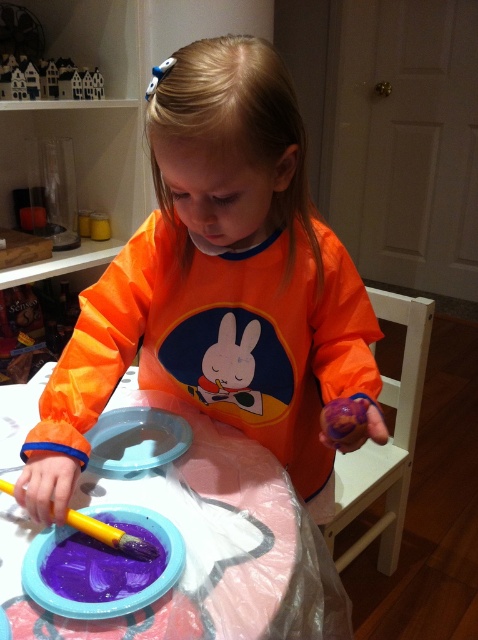
Question: Which object is positioned closest to the purple plastic plate at lower center?

Choices:
 (A) yellow plastic paint brush at lower left
 (B) purple rubber toy at lower center
 (C) wooden toy houses at upper left
 (D) orange matte shirt at center

Answer: (A)

Question: Among these objects, which one is farthest from the camera?

Choices:
 (A) orange matte shirt at center
 (B) plastic covered table at center

Answer: (A)

Question: Is orange matte shirt at center closer to the viewer compared to transparent plastic plate at center?

Choices:
 (A) no
 (B) yes

Answer: (B)

Question: Can you confirm if orange matte shirt at center is positioned below yellow plastic paint brush at lower left?

Choices:
 (A) no
 (B) yes

Answer: (A)

Question: Does orange matte shirt at center have a lesser width compared to yellow plastic paint brush at lower left?

Choices:
 (A) no
 (B) yes

Answer: (A)

Question: Which of the following is the closest to the observer?

Choices:
 (A) (64, 352)
 (B) (141, 435)

Answer: (B)